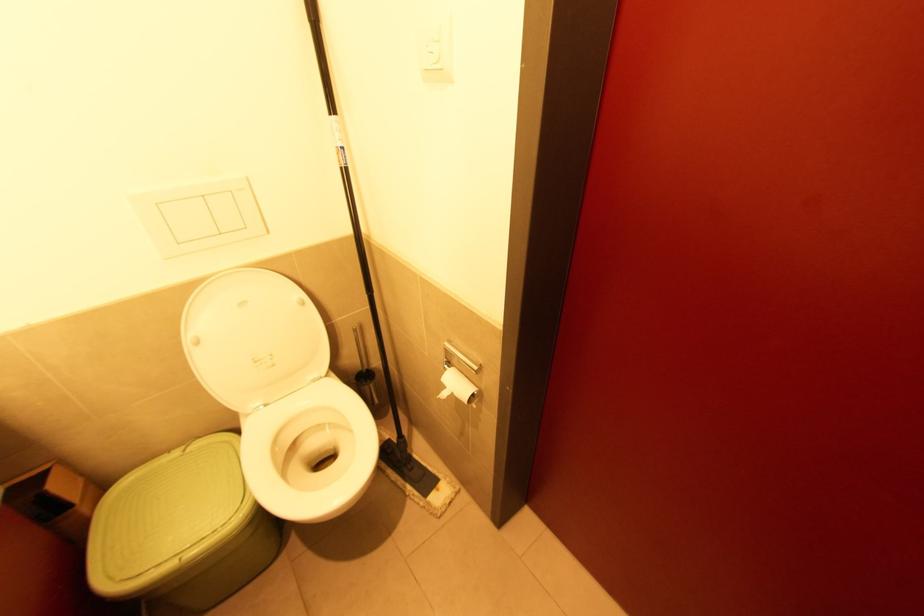
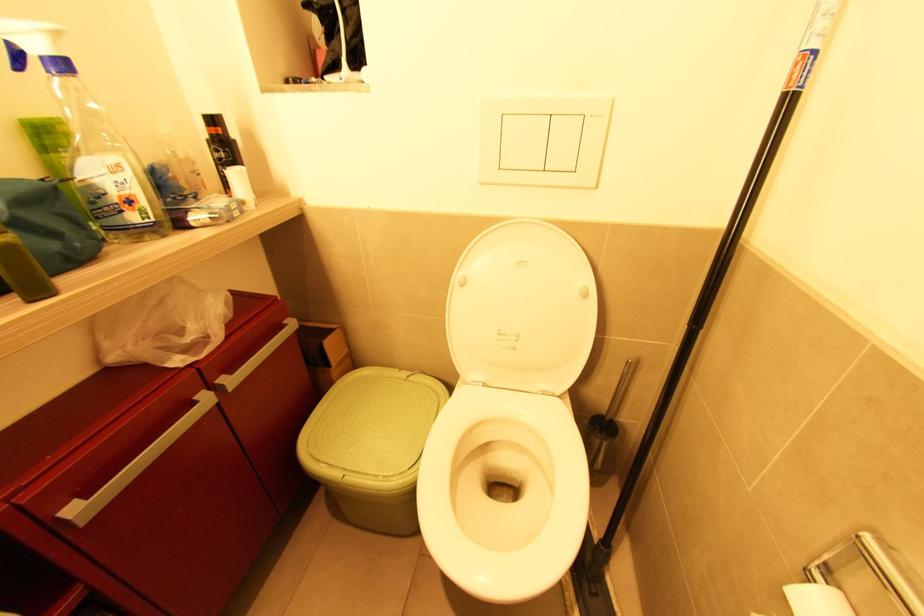
Question: The first image is from the beginning of the video and the second image is from the end. How did the camera likely rotate when shooting the video?

Choices:
 (A) Left
 (B) Right
 (C) Up
 (D) Down

Answer: (A)